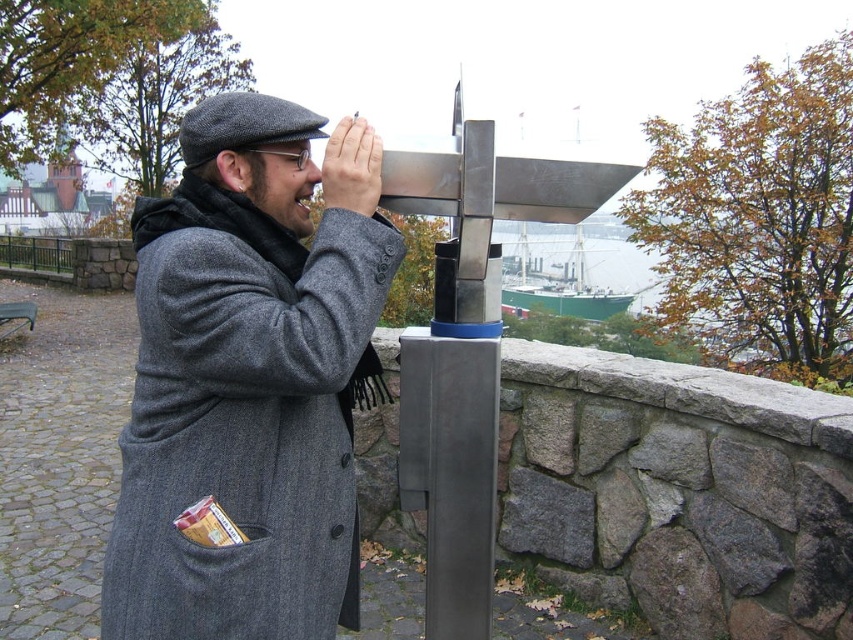
Question: Which of the following is the closest to the observer?

Choices:
 (A) gray wool coat at center
 (B) matte gray nose at center

Answer: (A)

Question: Is gray wool coat at center positioned in front of matte gray nose at center?

Choices:
 (A) no
 (B) yes

Answer: (B)

Question: Is gray wool coat at center smaller than matte gray nose at center?

Choices:
 (A) yes
 (B) no

Answer: (B)

Question: Which point is closer to the camera?

Choices:
 (A) gray wool coat at center
 (B) matte gray nose at center

Answer: (A)

Question: Is gray wool coat at center to the right of matte gray nose at center from the viewer's perspective?

Choices:
 (A) no
 (B) yes

Answer: (A)

Question: Which point is farther from the camera taking this photo?

Choices:
 (A) (305, 173)
 (B) (285, 461)

Answer: (A)